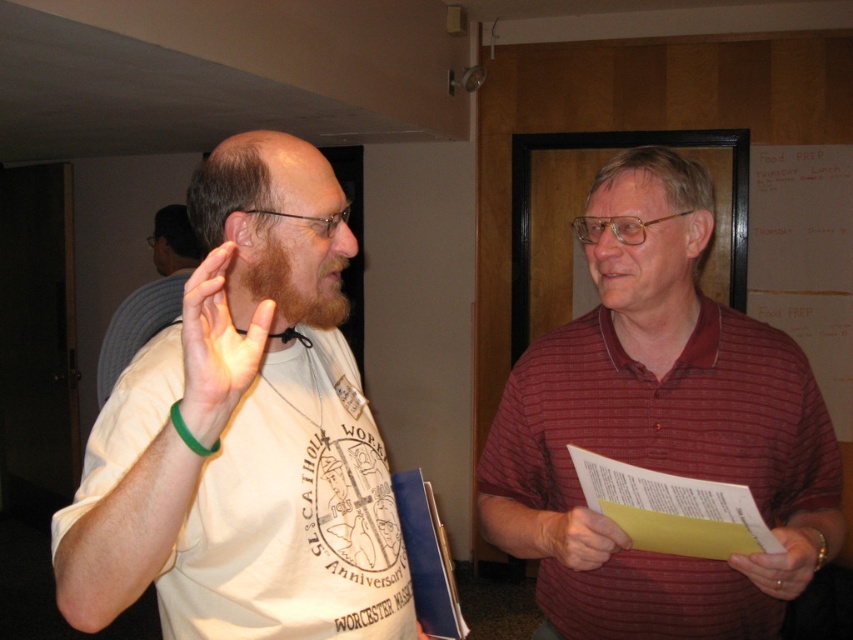
Based on the scene description, which object is taller between the striped cotton shirt at center and the matte white shirt at center?

The striped cotton shirt at center is taller than the matte white shirt at center.